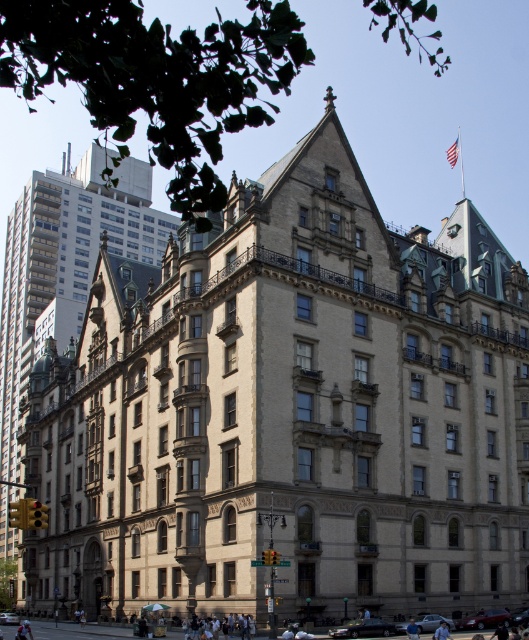
Is point (4, 544) less distant than point (360, 634)?

No, it is not.

Between point (51, 232) and point (336, 628), which one is positioned in front?

Point (336, 628)

Where is `stone building at center`? The image size is (529, 640). stone building at center is located at coordinates (59, 259).

Between stone building at center and shiny black car at lower right, which one has less height?

shiny black car at lower right is shorter.

Looking at this image, is stone building at center to the right of shiny black car at lower right from the viewer's perspective?

No, stone building at center is not to the right of shiny black car at lower right.

Is point (25, 200) positioned in front of point (517, 614)?

No, it is not.

At what (x,y) coordinates should I click in order to perform the action: click on stone building at center. Please return your answer as a coordinate pair (x, y). This screenshot has height=640, width=529. Looking at the image, I should click on (59, 259).

Can you confirm if shiny black sedan at lower center is thinner than silver metallic sedan at lower center?

In fact, shiny black sedan at lower center might be wider than silver metallic sedan at lower center.

Does shiny black sedan at lower center have a greater width compared to silver metallic sedan at lower center?

Yes, shiny black sedan at lower center is wider than silver metallic sedan at lower center.

Who is more distant from viewer, (352, 628) or (399, 628)?

The point (399, 628) is more distant.

Locate an element on the screen. Image resolution: width=529 pixels, height=640 pixels. shiny black sedan at lower center is located at coordinates (363, 628).